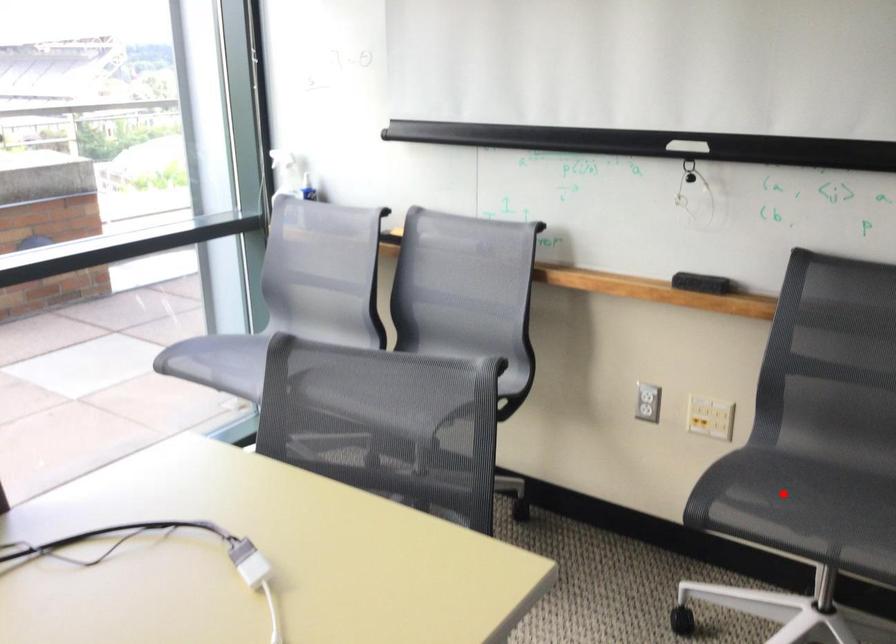
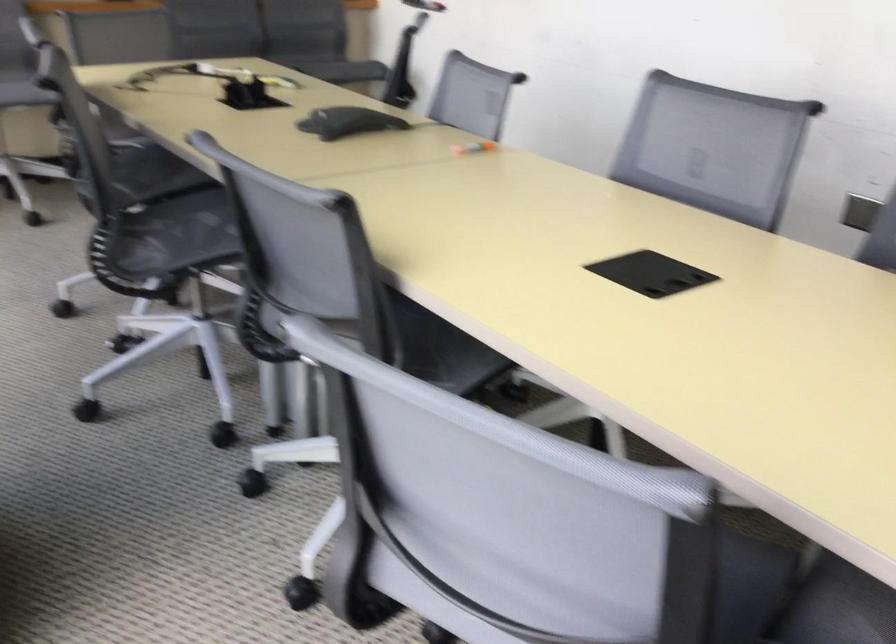
Question: I am providing you with two images of the same scene from different viewpoints. A red point is marked on the first image. At the location where the point appears in image 1, is it still visible in image 2?

Choices:
 (A) Yes
 (B) No

Answer: (B)